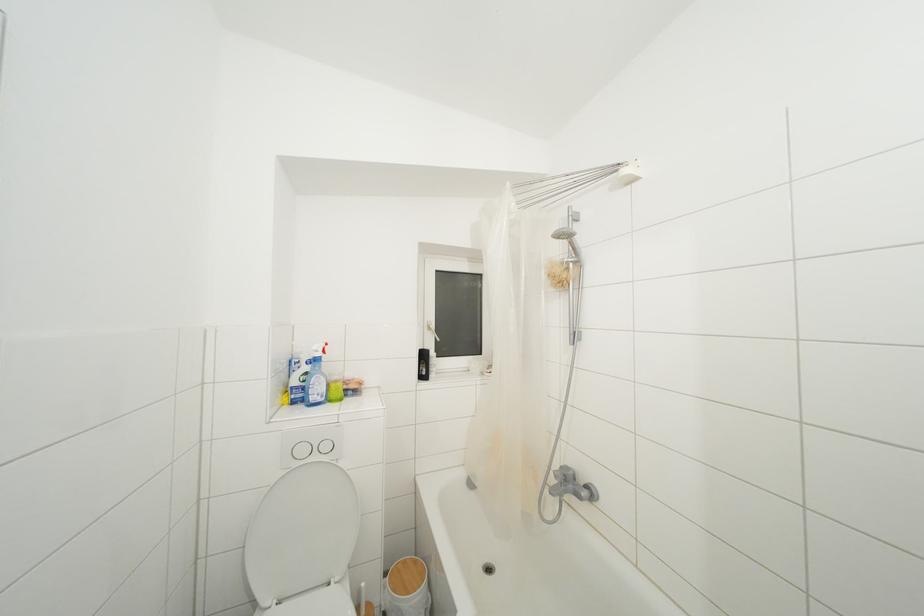
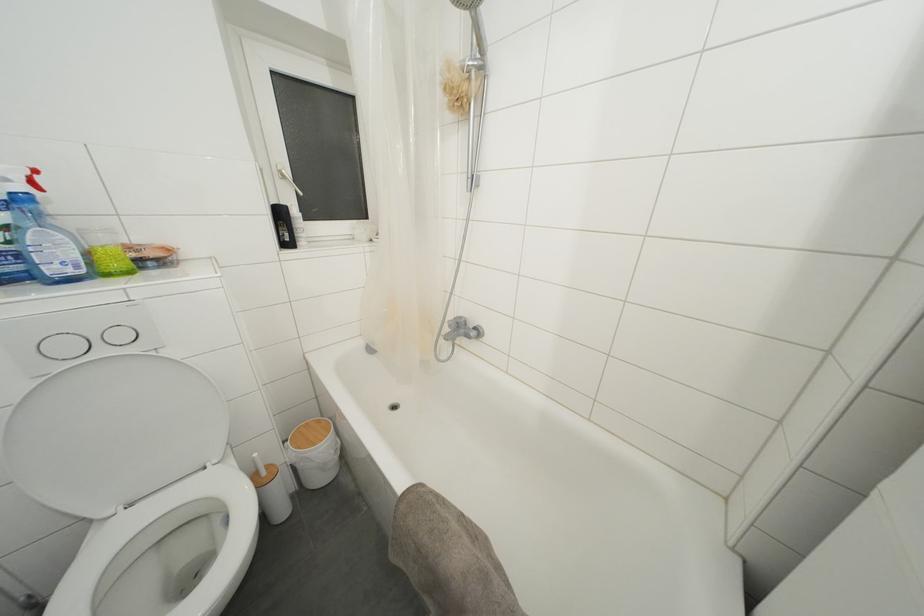
Locate, in the second image, the point that corresponds to (320,463) in the first image.

(106, 357)